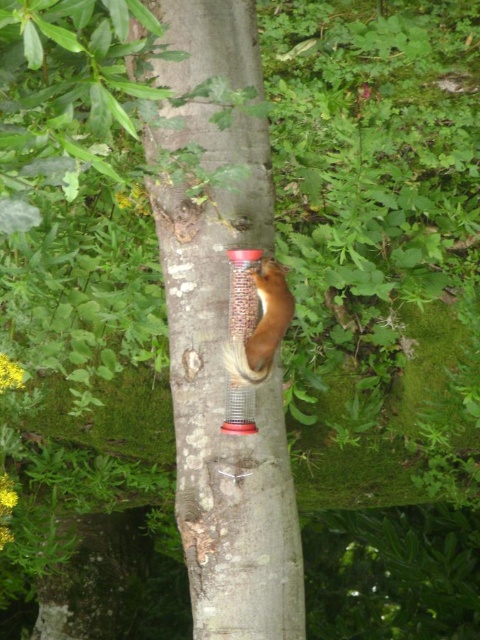
Can you confirm if smooth bark tree trunk at center is taller than golden-brown fur squirrel at center?

Yes, smooth bark tree trunk at center is taller than golden-brown fur squirrel at center.

In the scene shown: Can you confirm if smooth bark tree trunk at center is positioned above golden-brown fur squirrel at center?

Indeed, smooth bark tree trunk at center is positioned over golden-brown fur squirrel at center.

This screenshot has height=640, width=480. Find the location of `smooth bark tree trunk at center`. smooth bark tree trunk at center is located at coordinates (224, 387).

From the picture: Does smooth bark tree trunk at center have a larger size compared to transparent plastic bird feeder at center?

Correct, smooth bark tree trunk at center is larger in size than transparent plastic bird feeder at center.

Who is more distant from viewer, (260, 580) or (247, 404)?

Positioned behind is point (260, 580).

Locate an element on the screen. This screenshot has height=640, width=480. smooth bark tree trunk at center is located at coordinates (224, 387).

Who is lower down, golden-brown fur squirrel at center or transparent plastic bird feeder at center?

transparent plastic bird feeder at center is below.

Does golden-brown fur squirrel at center appear on the right side of transparent plastic bird feeder at center?

Correct, you'll find golden-brown fur squirrel at center to the right of transparent plastic bird feeder at center.

Is point (269, 300) positioned behind point (227, 426)?

No, (269, 300) is in front of (227, 426).

The width and height of the screenshot is (480, 640). Identify the location of golden-brown fur squirrel at center. (262, 326).